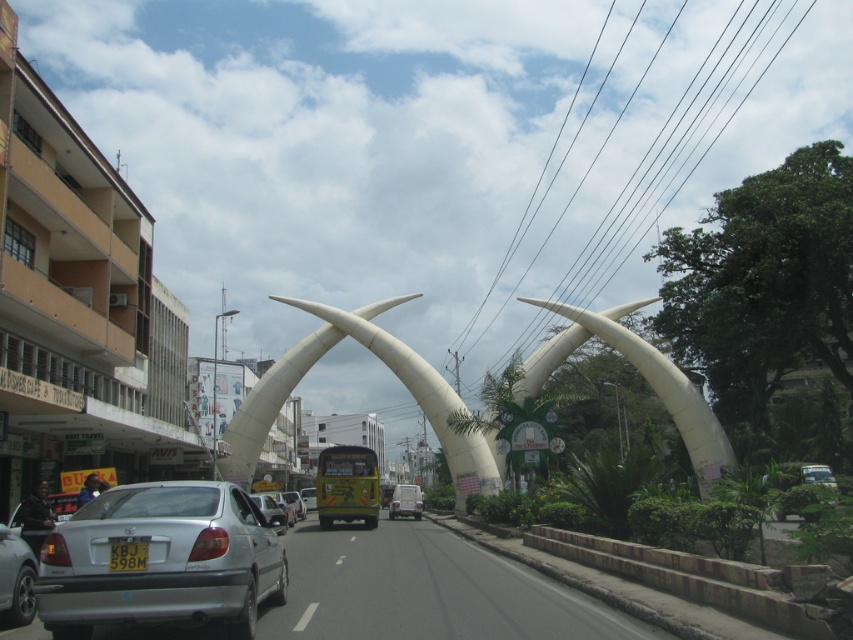
You are a delivery person who needs to park your silver metallic car at lower left in a parking spot that is exactly the width of the black plastic license plate at center. Can your car fit in the parking spot?

The silver metallic car at lower left might be wider than the black plastic license plate at center, so there is a possibility that the car may not fit in the parking spot.

You are standing on the sidewalk next to the black plastic license plate at center. You want to walk to the nearest building entrance. The nearest building entrance is 5 meters away from you. Can you reach it without crossing the street?

The black plastic license plate at center is 6.76 meters away from the viewer. Since the nearest building entrance is only 5 meters away, you can reach it without crossing the street as it is closer than the distance to the license plate.

You are a delivery driver who needs to park your silver metallic car at lower left as close as possible to the black plastic license plate at center without going over the 10 feet distance limit. Can you park your car within the allowed distance?

The silver metallic car at lower left is 8.59 feet from the black plastic license plate at center, so yes, you can park the silver metallic car at lower left within the allowed distance since 8.59 feet is under the 10 feet limit.